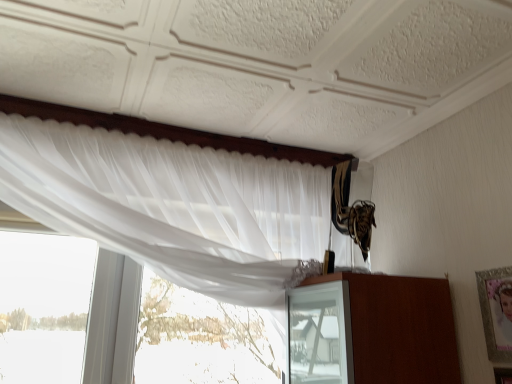
Question: Based on their positions, is silver metallic picture frame at upper right located to the left or right of white sheer curtain at upper left?

Choices:
 (A) right
 (B) left

Answer: (A)

Question: Is silver metallic picture frame at upper right spatially inside white sheer curtain at upper left, or outside of it?

Choices:
 (A) inside
 (B) outside

Answer: (B)

Question: Is point (483, 271) closer or farther from the camera than point (163, 180)?

Choices:
 (A) closer
 (B) farther

Answer: (A)

Question: From the image's perspective, is white sheer curtain at upper left above or below silver metallic picture frame at upper right?

Choices:
 (A) above
 (B) below

Answer: (A)

Question: Considering their positions, is white sheer curtain at upper left located in front of or behind silver metallic picture frame at upper right?

Choices:
 (A) behind
 (B) front

Answer: (B)

Question: From their relative heights in the image, would you say white sheer curtain at upper left is taller or shorter than silver metallic picture frame at upper right?

Choices:
 (A) short
 (B) tall

Answer: (B)

Question: Would you say white sheer curtain at upper left is to the left or to the right of silver metallic picture frame at upper right in the picture?

Choices:
 (A) left
 (B) right

Answer: (A)